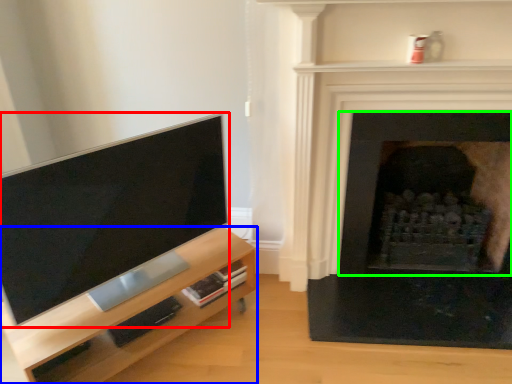
Question: Based on their relative distances, which object is nearer to television (highlighted by a red box)? Choose from entertainment center (highlighted by a blue box) and fireplace (highlighted by a green box).

Choices:
 (A) entertainment center
 (B) fireplace

Answer: (A)